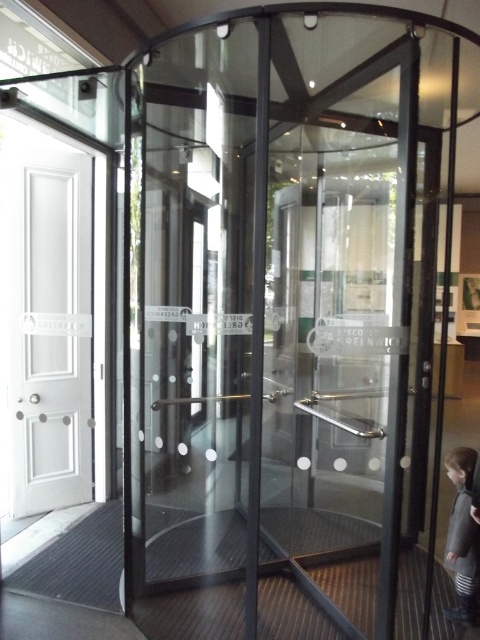
You are carrying a large 40 inch wide box and need to enter through either the transparent glass door at center or the white matte door at left. Which door can you use without needing to adjust the box?

The transparent glass door at center and white matte door at left are 38.86 inches apart from each other. Since the box is 40 inches wide, it is wider than the gap between the doors. Therefore, neither door can accommodate the box without adjustment.

You are a delivery person carrying a large package that requires going through the entrance. You see the white matte door at left and the dark gray coat at lower right. Which entrance is taller and more suitable for carrying your package?

The white matte door at left is taller than the dark gray coat at lower right, so it is more suitable for carrying your large package.